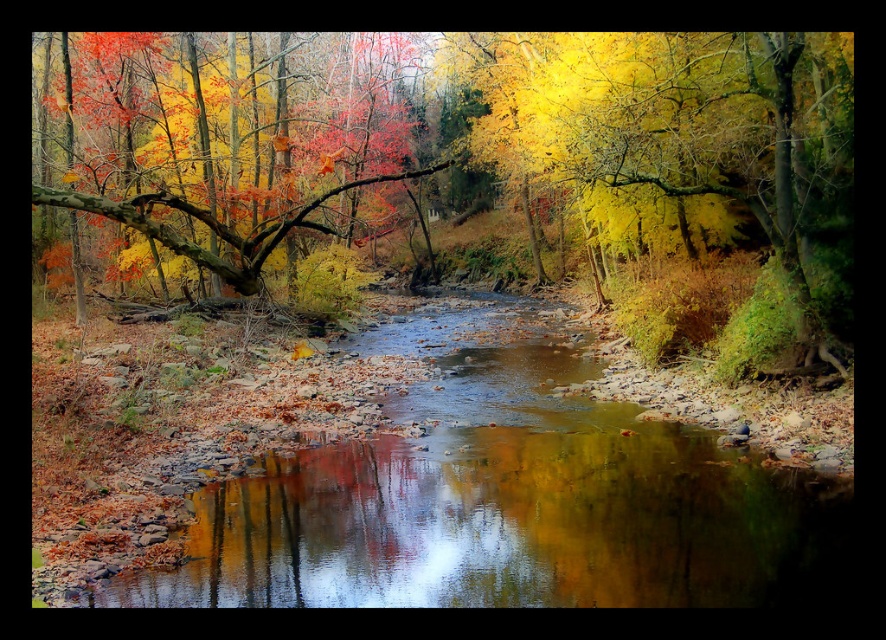
Question: Which of the following is the farthest from the observer?

Choices:
 (A) (339, 154)
 (B) (799, 260)
 (C) (786, 582)

Answer: (A)

Question: Which object appears farthest from the camera in this image?

Choices:
 (A) yellow matte tree at center
 (B) shiny reflective water at center
 (C) smooth brown branch at upper left

Answer: (A)

Question: Is the position of shiny reflective water at center more distant than that of yellow matte tree at center?

Choices:
 (A) no
 (B) yes

Answer: (A)

Question: Is shiny reflective water at center below smooth brown branch at upper left?

Choices:
 (A) yes
 (B) no

Answer: (A)

Question: Is matte brown tree trunk at center to the left of shiny reflective water at center from the viewer's perspective?

Choices:
 (A) yes
 (B) no

Answer: (A)

Question: Among these points, which one is farthest from the camera?

Choices:
 (A) (255, 564)
 (B) (377, 156)

Answer: (B)